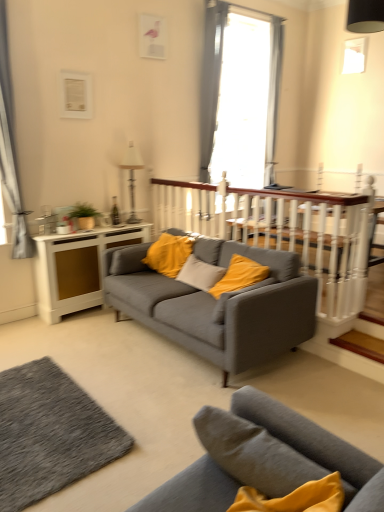
Locate an element on the screen. vacant space that is to the left of matte gray couch at center, which is the first studio couch from back to front is located at coordinates (81, 344).